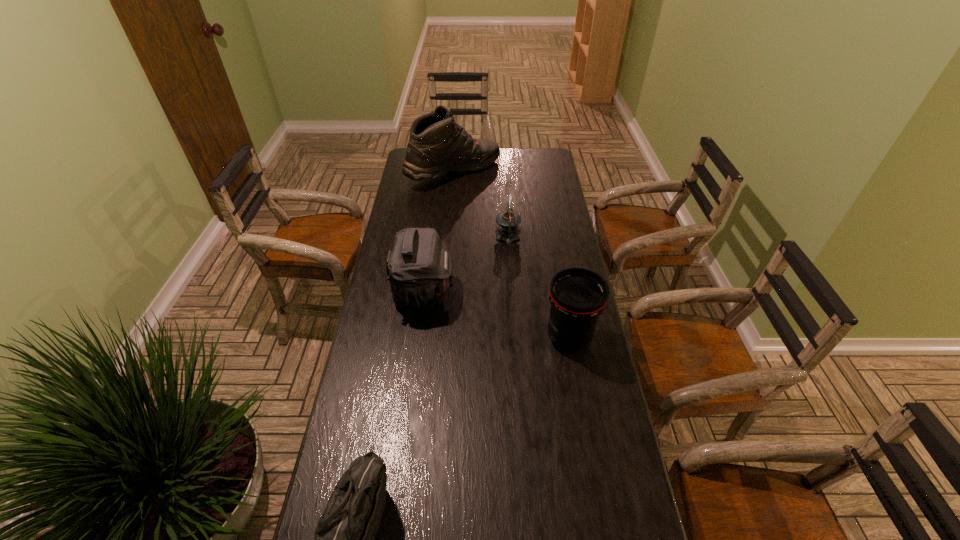
Identify the location of shoulder bag that is positioned at the left edge. (419, 269).

Where is `object present at the right edge`? The height and width of the screenshot is (540, 960). object present at the right edge is located at coordinates (578, 296).

Where is `object that is positioned at the far left corner`? The image size is (960, 540). object that is positioned at the far left corner is located at coordinates (437, 145).

Find the location of a particular element. This screenshot has height=540, width=960. free space at the far edge of the desktop is located at coordinates (490, 166).

The image size is (960, 540). In the image, there is a desktop. What are the coordinates of `free space at the left edge` in the screenshot? It's located at (346, 444).

You are a GUI agent. You are given a task and a screenshot of the screen. Output one action in this format:
    pyautogui.click(x=<x>, y=<y>)
    Task: Click on the blank space at the right edge of the desktop
    Image resolution: width=960 pixels, height=540 pixels.
    Given the screenshot: What is the action you would take?
    pyautogui.click(x=533, y=172)

Where is `vacant space at the far right corner`? Image resolution: width=960 pixels, height=540 pixels. vacant space at the far right corner is located at coordinates pyautogui.click(x=527, y=167).

Identify the location of vacant space that's between the telephoto lens and the oil lamp. (539, 288).

Image resolution: width=960 pixels, height=540 pixels. Find the location of `free area in between the taller shoulder bag and the farthest object`. free area in between the taller shoulder bag and the farthest object is located at coordinates (439, 232).

At what (x,y) coordinates should I click in order to perform the action: click on vacant region between the second farthest object and the rightmost object. Please return your answer as a coordinate pair (x, y). The image size is (960, 540). Looking at the image, I should click on (539, 288).